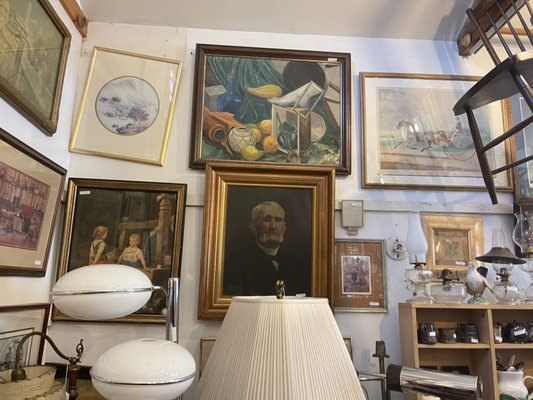
At what (x,y) coordinates should I click in order to perform the action: click on duck statue. Please return your answer as a coordinate pair (x, y). Looking at the image, I should click on (471, 284).